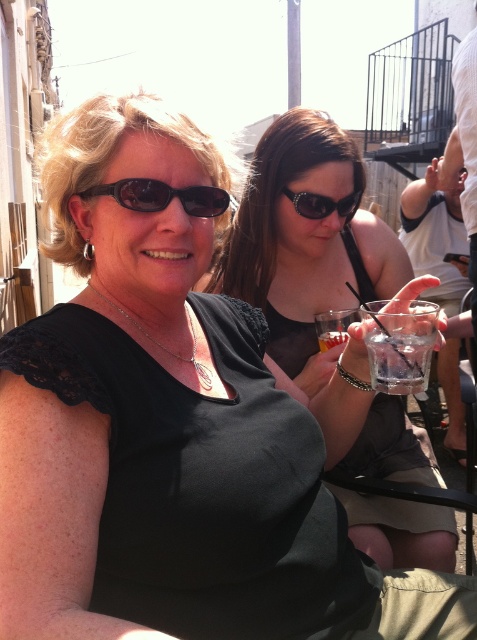
Which is above, black shiny sunglasses at center or clear glass at center?

Positioned higher is black shiny sunglasses at center.

Can you confirm if black shiny sunglasses at center is wider than clear glass at center?

Yes.

Is point (314, 208) less distant than point (328, 337)?

No, (314, 208) is behind (328, 337).

You are a GUI agent. You are given a task and a screenshot of the screen. Output one action in this format:
    pyautogui.click(x=<x>, y=<y>)
    Task: Click on the black shiny sunglasses at center
    
    Given the screenshot: What is the action you would take?
    pyautogui.click(x=321, y=204)

Is the position of matte black sunglasses at upper left more distant than that of black shiny sunglasses at center?

That is False.

Between point (116, 182) and point (345, 204), which one is positioned in front?

Point (116, 182) is more forward.

At what (x,y) coordinates should I click in order to perform the action: click on matte black sunglasses at upper left. Please return your answer as a coordinate pair (x, y). This screenshot has height=640, width=477. Looking at the image, I should click on click(x=164, y=196).

From the picture: Between clear glass at lower right and matte black sunglasses at upper left, which one is positioned higher?

Positioned higher is matte black sunglasses at upper left.

Between clear glass at lower right and matte black sunglasses at upper left, which one appears on the left side from the viewer's perspective?

From the viewer's perspective, matte black sunglasses at upper left appears more on the left side.

What do you see at coordinates (398, 358) in the screenshot? I see `clear glass at lower right` at bounding box center [398, 358].

Locate an element on the screen. Image resolution: width=477 pixels, height=640 pixels. clear glass at lower right is located at coordinates (398, 358).